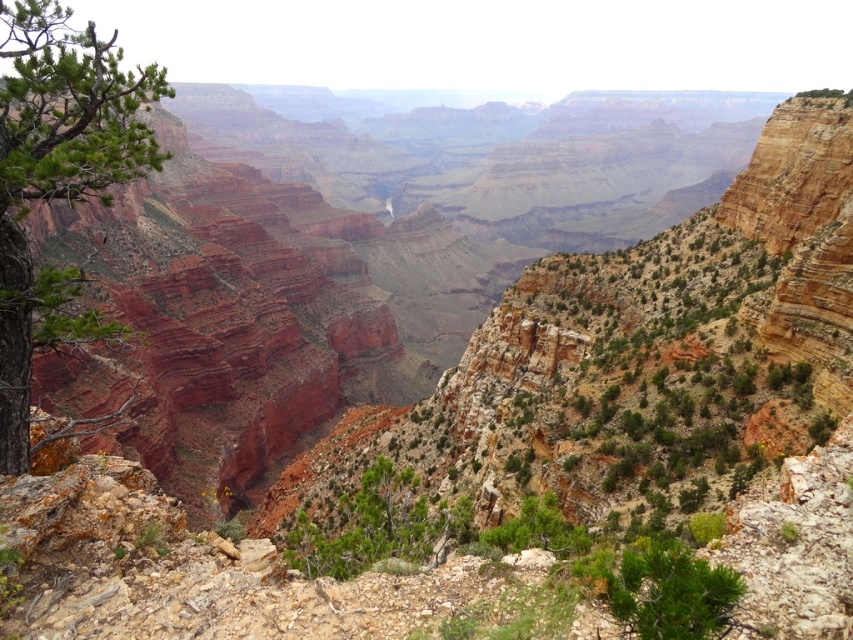
Question: Among these points, which one is nearest to the camera?

Choices:
 (A) (300, 570)
 (B) (724, 589)

Answer: (B)

Question: Which object is the farthest from the green matte tree at center?

Choices:
 (A) green textured pine tree at left
 (B) green rough textured bush at lower right

Answer: (A)

Question: Does green textured pine tree at left come in front of green matte tree at center?

Choices:
 (A) yes
 (B) no

Answer: (A)

Question: Which of the following is the closest to the observer?

Choices:
 (A) (67, 10)
 (B) (409, 493)

Answer: (A)

Question: Can you confirm if green textured pine tree at left is positioned to the left of green rough textured bush at lower right?

Choices:
 (A) yes
 (B) no

Answer: (A)

Question: In this image, where is green matte tree at center located relative to green rough textured bush at lower right?

Choices:
 (A) below
 (B) above

Answer: (A)